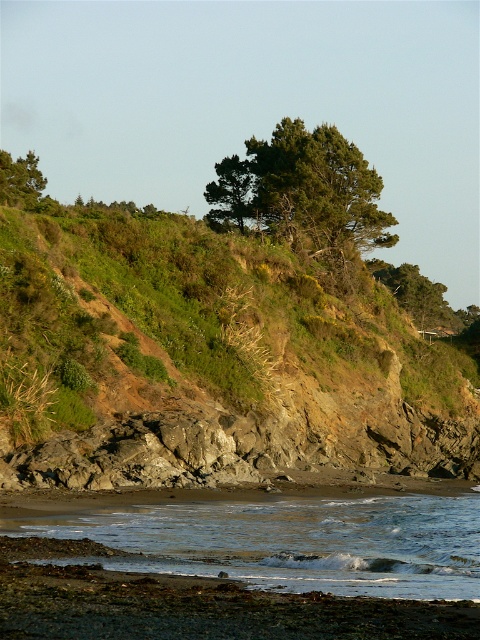
Does green grassy hillside at upper center appear on the right side of clear water at lower center?

No, green grassy hillside at upper center is not to the right of clear water at lower center.

You are a GUI agent. You are given a task and a screenshot of the screen. Output one action in this format:
    pyautogui.click(x=<x>, y=<y>)
    Task: Click on the green grassy hillside at upper center
    The height and width of the screenshot is (640, 480).
    Given the screenshot: What is the action you would take?
    pyautogui.click(x=208, y=355)

Identify the location of green grassy hillside at upper center. The image size is (480, 640). (208, 355).

Where is `green grassy hillside at upper center`? This screenshot has height=640, width=480. green grassy hillside at upper center is located at coordinates point(208,355).

Does green grassy hillside at upper center have a smaller size compared to green leafy tree at upper left?

Yes, green grassy hillside at upper center is smaller than green leafy tree at upper left.

Can you confirm if green grassy hillside at upper center is wider than green leafy tree at upper left?

Incorrect, green grassy hillside at upper center's width does not surpass green leafy tree at upper left's.

Measure the distance between point (398,429) and camera.

Point (398,429) and camera are 62.90 meters apart from each other.

You are a GUI agent. You are given a task and a screenshot of the screen. Output one action in this format:
    pyautogui.click(x=<x>, y=<y>)
    Task: Click on the green grassy hillside at upper center
    
    Given the screenshot: What is the action you would take?
    pyautogui.click(x=208, y=355)

Is clear water at lower center further to camera compared to green leafy tree at upper left?

No, it is not.

Can you confirm if clear water at lower center is wider than green leafy tree at upper left?

No, clear water at lower center is not wider than green leafy tree at upper left.

Which is behind, point (357, 572) or point (6, 157)?

Positioned behind is point (6, 157).

At what (x,y) coordinates should I click in order to perform the action: click on clear water at lower center. Please return your answer as a coordinate pair (x, y). Image resolution: width=480 pixels, height=640 pixels. Looking at the image, I should click on (294, 541).